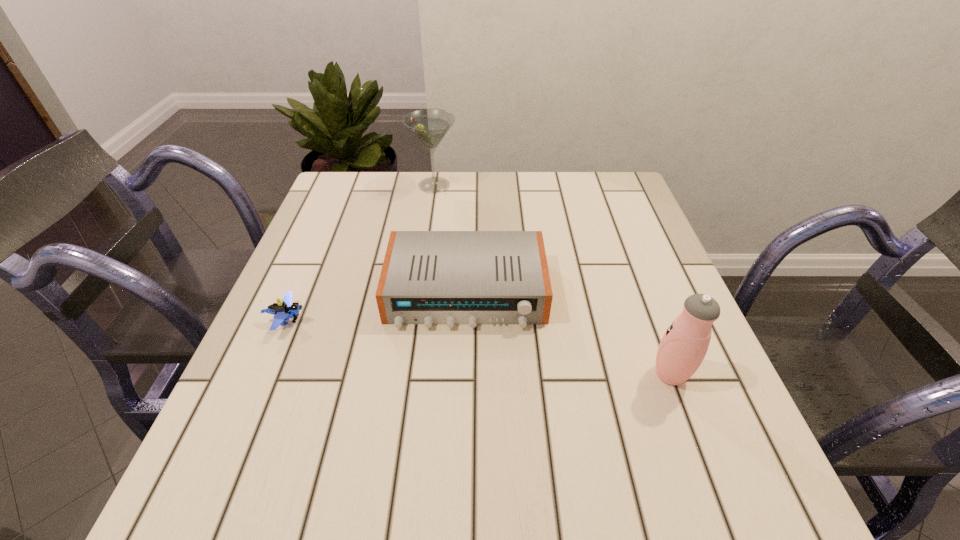
Identify the location of free space between the martini and the thermos bottle. (552, 280).

Identify the location of vacant point located between the nearest object and the leftmost object. (478, 347).

Where is `free point between the leftmost object and the martini`? The width and height of the screenshot is (960, 540). free point between the leftmost object and the martini is located at coordinates pyautogui.click(x=361, y=253).

Locate an element on the screen. This screenshot has width=960, height=540. vacant area that lies between the farthest object and the thermos bottle is located at coordinates (552, 280).

Find the location of `free area in between the second shortest object and the shortest object`. free area in between the second shortest object and the shortest object is located at coordinates (376, 306).

Where is `free point between the radio receiver and the shortest object`? The height and width of the screenshot is (540, 960). free point between the radio receiver and the shortest object is located at coordinates point(376,306).

Locate which object is the third closest to the nearest object. Please provide its 2D coordinates. Your answer should be formatted as a tuple, i.e. [(x, y)], where the tuple contains the x and y coordinates of a point satisfying the conditions above.

[(284, 310)]

Point out which object is positioned as the nearest to the thermos bottle. Please provide its 2D coordinates. Your answer should be formatted as a tuple, i.e. [(x, y)], where the tuple contains the x and y coordinates of a point satisfying the conditions above.

[(428, 277)]

Find the location of a particular element. vacant space that satisfies the following two spatial constraints: 1. on the front side of the nearest object; 2. on the right side of the martini is located at coordinates (407, 374).

Find the location of a particular element. This screenshot has height=540, width=960. vacant space that satisfies the following two spatial constraints: 1. on the front side of the farthest object; 2. on the front-facing side of the leftmost object is located at coordinates (415, 320).